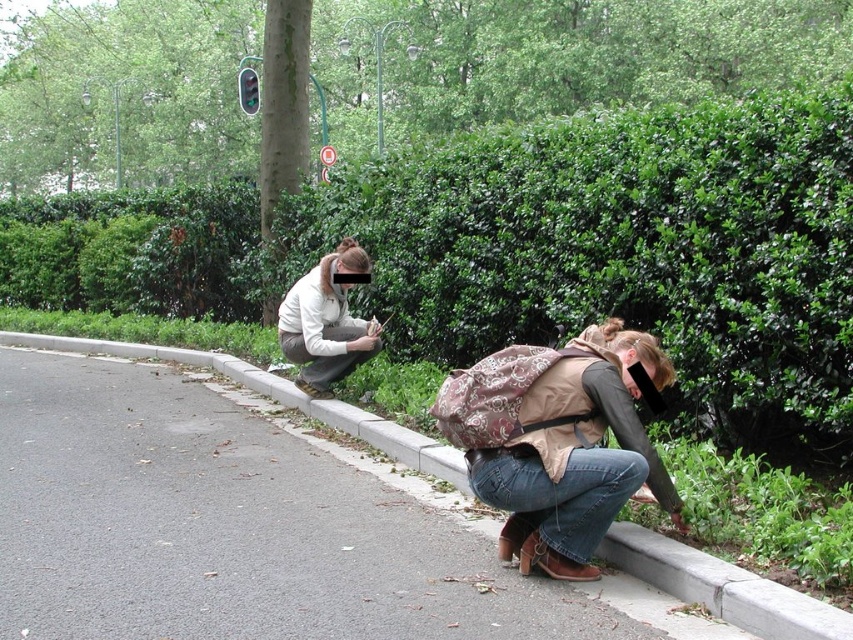
Which is behind, point (616, 458) or point (317, 292)?

Point (317, 292)

Is brown fabric backpack at lower center to the right of white matte jacket at upper left from the viewer's perspective?

Yes, brown fabric backpack at lower center is to the right of white matte jacket at upper left.

Image resolution: width=853 pixels, height=640 pixels. In order to click on brown fabric backpack at lower center in this screenshot , I will do `click(575, 454)`.

Between brown floral backpack at center and white matte jacket at upper left, which one appears on the left side from the viewer's perspective?

white matte jacket at upper left is more to the left.

Who is higher up, brown floral backpack at center or white matte jacket at upper left?

white matte jacket at upper left is above.

Between point (496, 413) and point (323, 344), which one is positioned behind?

The point (323, 344) is more distant.

Where is `brown floral backpack at center`? This screenshot has height=640, width=853. brown floral backpack at center is located at coordinates (560, 442).

Which is in front, point (698, 172) or point (386, 449)?

Point (698, 172) is more forward.

Between point (848, 84) and point (418, 442), which one is positioned behind?

Positioned behind is point (418, 442).

Which is behind, point (750, 168) or point (151, 346)?

The point (151, 346) is more distant.

At what (x,y) coordinates should I click in order to perform the action: click on green leafy hedge at upper center. Please return your answer as a coordinate pair (x, y). Looking at the image, I should click on (570, 250).